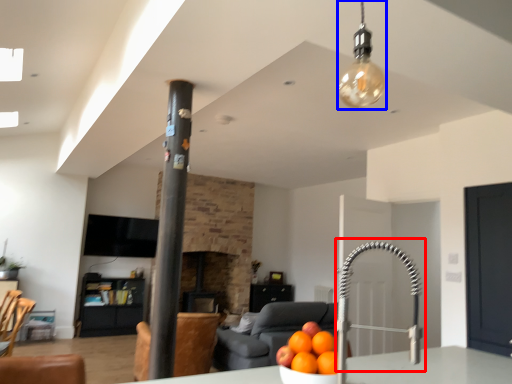
Question: Which object appears closest to the camera in this image, faucet (highlighted by a red box) or light fixture (highlighted by a blue box)?

Choices:
 (A) faucet
 (B) light fixture

Answer: (A)